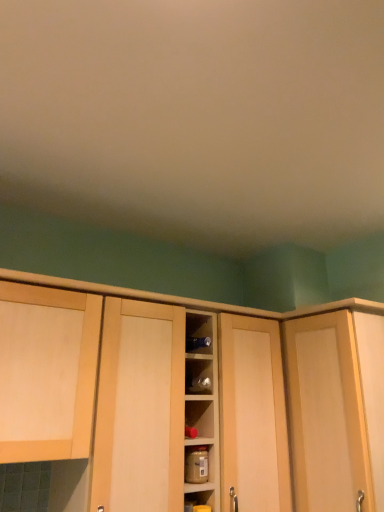
Question: Which direction should I rotate to face wooden cabinet at center, marked as the 1th cabinetry in a right-to-left arrangement, — up or down?

Choices:
 (A) down
 (B) up

Answer: (A)

Question: Does light wood cabinet at left, the 2th cabinetry positioned from the right, appear on the left side of brown matte jar at center?

Choices:
 (A) no
 (B) yes

Answer: (B)

Question: Is light wood cabinet at left, acting as the first cabinetry starting from the left, oriented towards brown matte jar at center?

Choices:
 (A) yes
 (B) no

Answer: (B)

Question: Considering the relative positions of light wood cabinet at left, acting as the first cabinetry starting from the left, and brown matte jar at center in the image provided, is light wood cabinet at left, acting as the first cabinetry starting from the left, to the right of brown matte jar at center from the viewer's perspective?

Choices:
 (A) yes
 (B) no

Answer: (B)

Question: From a real-world perspective, is light wood cabinet at left, acting as the first cabinetry starting from the left, below brown matte jar at center?

Choices:
 (A) yes
 (B) no

Answer: (B)

Question: From the image's perspective, is light wood cabinet at left, acting as the first cabinetry starting from the left, located beneath brown matte jar at center?

Choices:
 (A) yes
 (B) no

Answer: (B)

Question: Is light wood cabinet at left, the 2th cabinetry positioned from the right, turned away from brown matte jar at center?

Choices:
 (A) yes
 (B) no

Answer: (B)

Question: From a real-world perspective, is brown matte jar at center positioned under wooden cabinet at center, the 2th cabinetry positioned from the left, based on gravity?

Choices:
 (A) no
 (B) yes

Answer: (B)

Question: Is brown matte jar at center to the left of wooden cabinet at center, the 2th cabinetry positioned from the left, from the viewer's perspective?

Choices:
 (A) no
 (B) yes

Answer: (A)

Question: From a real-world perspective, is brown matte jar at center over wooden cabinet at center, the 2th cabinetry positioned from the left?

Choices:
 (A) yes
 (B) no

Answer: (B)

Question: Is brown matte jar at center shorter than wooden cabinet at center, marked as the 1th cabinetry in a right-to-left arrangement?

Choices:
 (A) no
 (B) yes

Answer: (B)

Question: Can you confirm if brown matte jar at center is positioned to the right of wooden cabinet at center, marked as the 1th cabinetry in a right-to-left arrangement?

Choices:
 (A) yes
 (B) no

Answer: (A)

Question: Is brown matte jar at center closer to the viewer compared to wooden cabinet at center, the 2th cabinetry positioned from the left?

Choices:
 (A) no
 (B) yes

Answer: (A)

Question: From a real-world perspective, does brown matte jar at center stand above light wood cabinet at left, the 2th cabinetry positioned from the right?

Choices:
 (A) yes
 (B) no

Answer: (B)